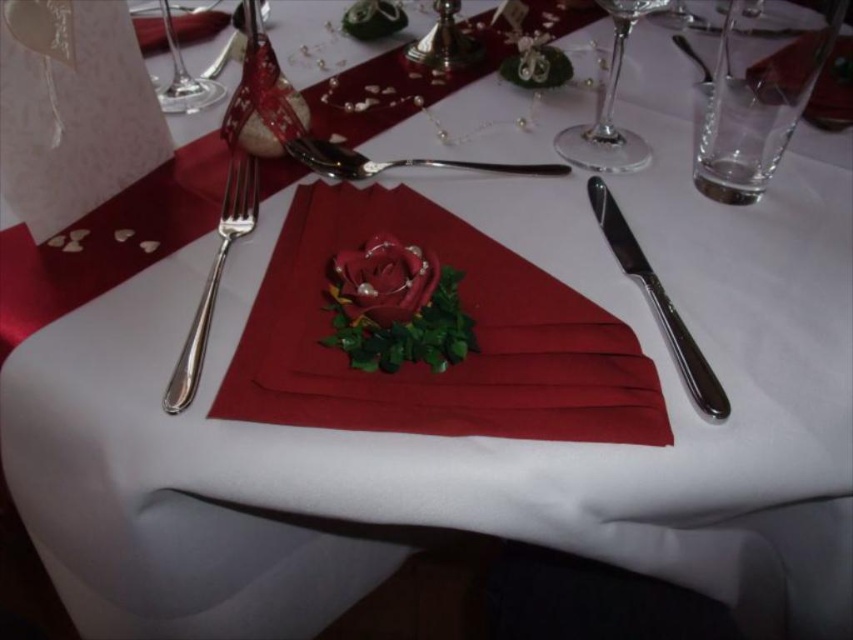
You are a guest at the formal dinner and want to place your napkin on your lap. Which item should you pick up first, the burgundy satin napkin at center or the polished metal spoon at center?

The burgundy satin napkin at center is located below the polished metal spoon at center, so you should pick up the burgundy satin napkin at center first.

You are standing at the edge of the table and want to reach for the point at coordinates point (416, 227). If your hand can extend 45 centimeters forward, will you be able to reach it?

The point (416, 227) is 47.20 centimeters from the viewer. Since your hand can only extend 45 centimeters, you will not be able to reach it.